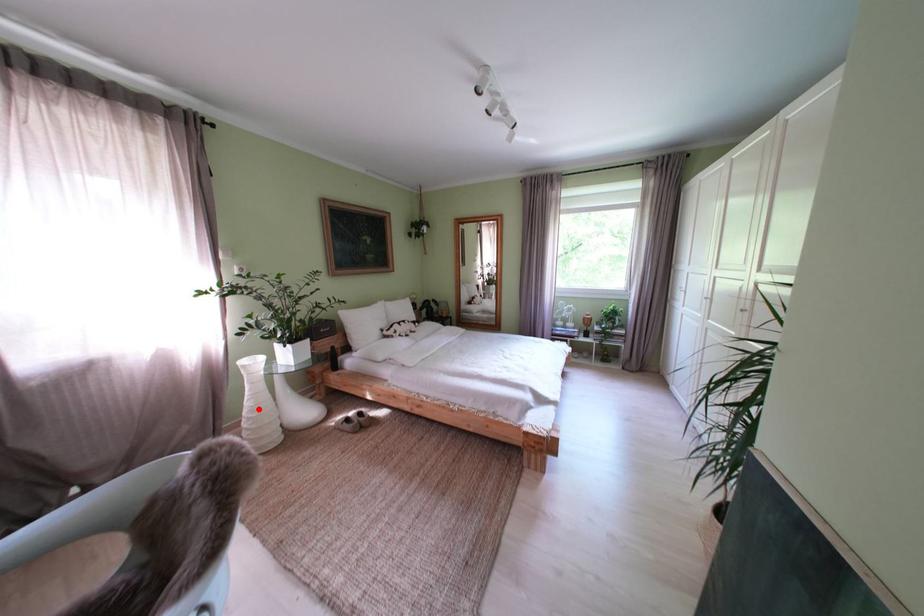
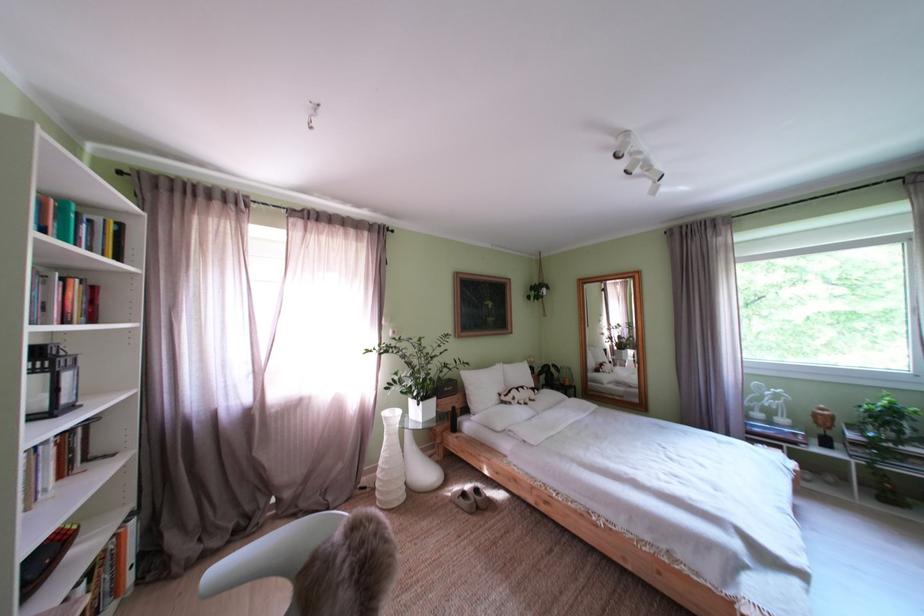
Locate, in the second image, the point that corresponds to the highlighted location in the first image.

(395, 460)